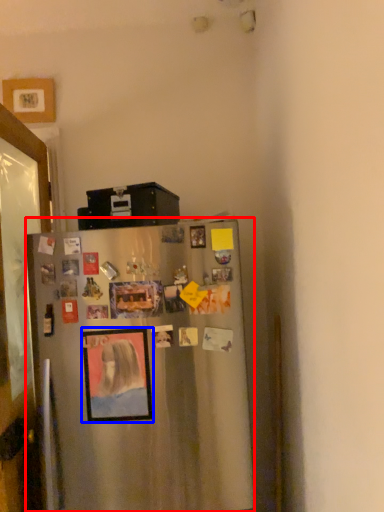
Question: Among these objects, which one is nearest to the camera, refrigerator (highlighted by a red box) or picture frame (highlighted by a blue box)?

Choices:
 (A) refrigerator
 (B) picture frame

Answer: (A)